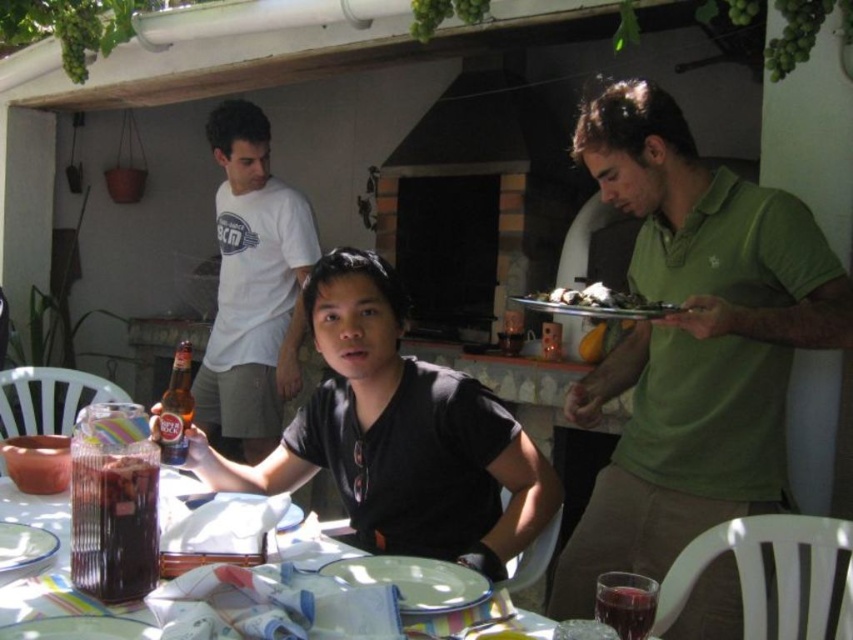
Question: Is translucent glass table at lower left below metallic silver platter at right?

Choices:
 (A) yes
 (B) no

Answer: (A)

Question: Which point is closer to the camera?

Choices:
 (A) click(x=637, y=132)
 (B) click(x=41, y=534)
 (C) click(x=653, y=301)

Answer: (B)

Question: Does translucent glass table at lower left lie behind white porcelain plate at lower left?

Choices:
 (A) yes
 (B) no

Answer: (B)

Question: Among these points, which one is nearest to the camera?

Choices:
 (A) click(154, 637)
 (B) click(691, 310)
 (C) click(242, 147)
 (D) click(357, 582)

Answer: (A)

Question: Which of the following is the closest to the observer?

Choices:
 (A) white glossy plate at lower left
 (B) white ceramic plate at center
 (C) metallic silver platter at right
 (D) shiny silver platter at center

Answer: (A)

Question: Is white cotton t-shirt at center above white ceramic plate at center?

Choices:
 (A) no
 (B) yes

Answer: (B)